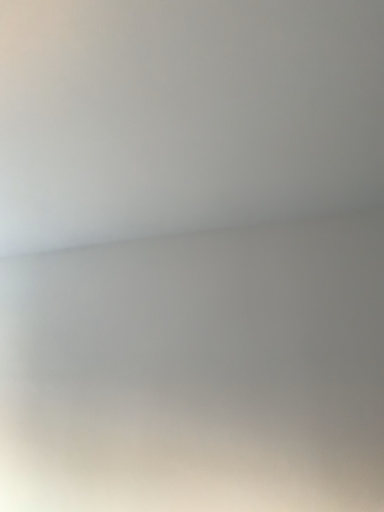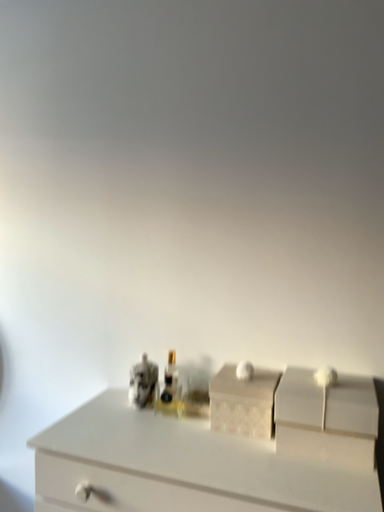
Question: Which way did the camera rotate in the video?

Choices:
 (A) rotated upward
 (B) rotated downward

Answer: (B)